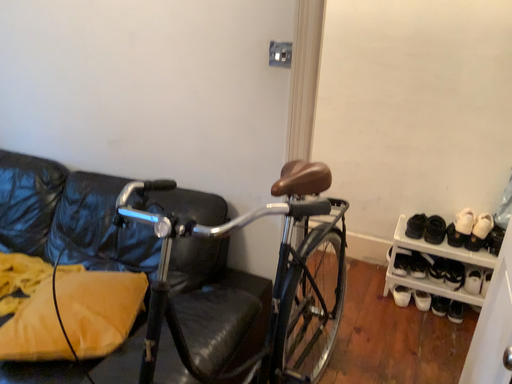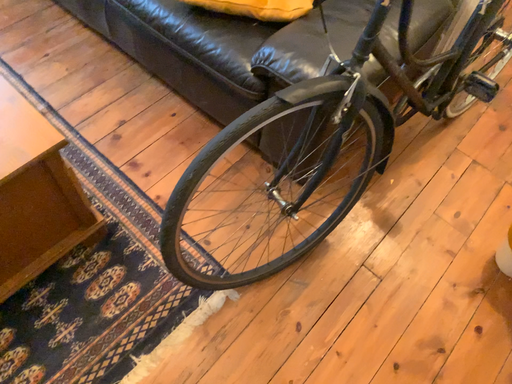
Question: Which way did the camera rotate in the video?

Choices:
 (A) rotated left
 (B) rotated right

Answer: (A)